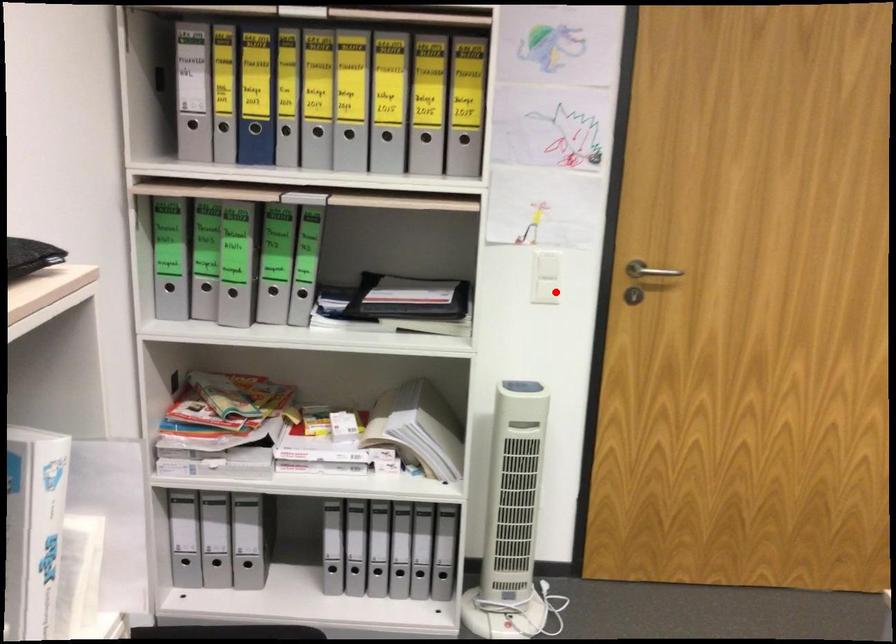
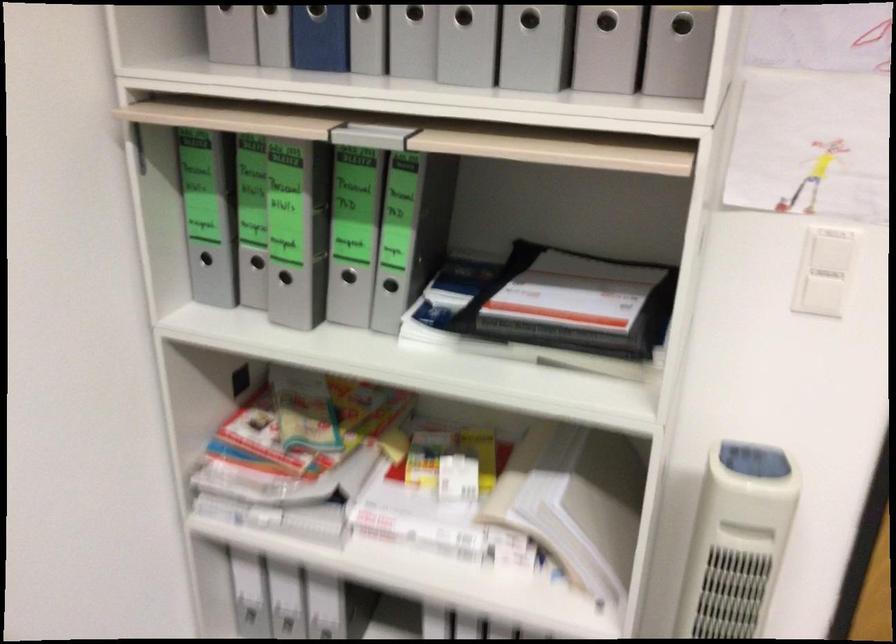
Find the pixel in the second image that matches the highlighted location in the first image.

(823, 295)